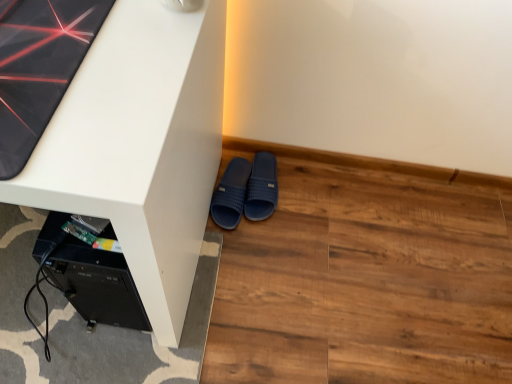
Question: Can you confirm if navy blue rubber slippers at lower center, the 2th footwear viewed from the left, is positioned to the right of white matte desk at center?

Choices:
 (A) no
 (B) yes

Answer: (B)

Question: Considering the relative sizes of navy blue rubber slippers at lower center, arranged as the 1th footwear when viewed from the right, and white matte desk at center in the image provided, is navy blue rubber slippers at lower center, arranged as the 1th footwear when viewed from the right, wider than white matte desk at center?

Choices:
 (A) yes
 (B) no

Answer: (B)

Question: Is navy blue rubber slippers at lower center, the 2th footwear viewed from the left, shorter than white matte desk at center?

Choices:
 (A) yes
 (B) no

Answer: (A)

Question: Can you confirm if navy blue rubber slippers at lower center, the 2th footwear viewed from the left, is bigger than white matte desk at center?

Choices:
 (A) no
 (B) yes

Answer: (A)

Question: Considering the relative sizes of navy blue rubber slippers at lower center, arranged as the 1th footwear when viewed from the right, and white matte desk at center in the image provided, is navy blue rubber slippers at lower center, arranged as the 1th footwear when viewed from the right, taller than white matte desk at center?

Choices:
 (A) yes
 (B) no

Answer: (B)

Question: In the image, is white matte desk at center positioned in front of or behind navy blue rubber slippers at lower center, arranged as the 1th footwear when viewed from the right?

Choices:
 (A) front
 (B) behind

Answer: (A)

Question: Is white matte desk at center bigger or smaller than navy blue rubber slippers at lower center, arranged as the 1th footwear when viewed from the right?

Choices:
 (A) big
 (B) small

Answer: (A)

Question: From the image's perspective, relative to navy blue rubber slippers at lower center, the 2th footwear viewed from the left, is white matte desk at center above or below?

Choices:
 (A) below
 (B) above

Answer: (B)

Question: In terms of width, does white matte desk at center look wider or thinner when compared to navy blue rubber slippers at lower center, arranged as the 1th footwear when viewed from the right?

Choices:
 (A) thin
 (B) wide

Answer: (B)

Question: In the image, is white matte desk at center positioned in front of or behind brown wood flooring at lower right?

Choices:
 (A) behind
 (B) front

Answer: (B)

Question: Is white matte desk at center spatially inside brown wood flooring at lower right, or outside of it?

Choices:
 (A) outside
 (B) inside

Answer: (A)

Question: Considering the positions of point (139, 281) and point (294, 192), is point (139, 281) closer or farther from the camera than point (294, 192)?

Choices:
 (A) farther
 (B) closer

Answer: (B)

Question: Looking at their shapes, would you say white matte desk at center is wider or thinner than brown wood flooring at lower right?

Choices:
 (A) thin
 (B) wide

Answer: (A)

Question: From the image's perspective, relative to white matte desk at center, is dark blue rubber slippers at lower center, which ranks as the first footwear in left-to-right order, above or below?

Choices:
 (A) above
 (B) below

Answer: (B)

Question: Looking at the image, does dark blue rubber slippers at lower center, which is counted as the 2th footwear, starting from the right, seem bigger or smaller compared to white matte desk at center?

Choices:
 (A) small
 (B) big

Answer: (A)